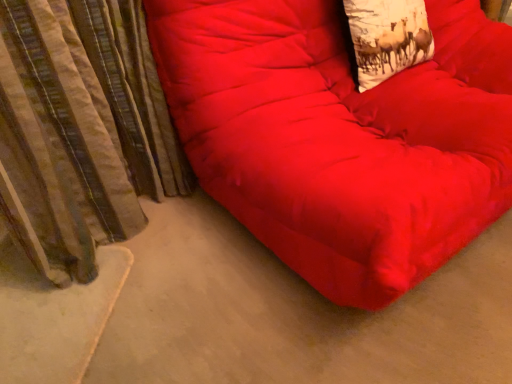
Question: Does white cotton throw pillow at upper right turn towards striped fabric curtain at left?

Choices:
 (A) no
 (B) yes

Answer: (A)

Question: Is white cotton throw pillow at upper right at the right side of striped fabric curtain at left?

Choices:
 (A) yes
 (B) no

Answer: (A)

Question: Considering the relative sizes of white cotton throw pillow at upper right and striped fabric curtain at left in the image provided, is white cotton throw pillow at upper right wider than striped fabric curtain at left?

Choices:
 (A) no
 (B) yes

Answer: (A)

Question: From a real-world perspective, does white cotton throw pillow at upper right sit lower than striped fabric curtain at left?

Choices:
 (A) yes
 (B) no

Answer: (B)

Question: Does white cotton throw pillow at upper right have a lesser width compared to striped fabric curtain at left?

Choices:
 (A) no
 (B) yes

Answer: (B)

Question: Is striped fabric curtain at left inside white cotton throw pillow at upper right?

Choices:
 (A) yes
 (B) no

Answer: (B)

Question: Is striped fabric curtain at left oriented away from matte red beanbag at center?

Choices:
 (A) no
 (B) yes

Answer: (A)

Question: Is striped fabric curtain at left next to matte red beanbag at center?

Choices:
 (A) yes
 (B) no

Answer: (B)

Question: From a real-world perspective, is striped fabric curtain at left positioned over matte red beanbag at center based on gravity?

Choices:
 (A) yes
 (B) no

Answer: (B)

Question: Is striped fabric curtain at left at the left side of matte red beanbag at center?

Choices:
 (A) yes
 (B) no

Answer: (A)

Question: From the image's perspective, is striped fabric curtain at left on top of matte red beanbag at center?

Choices:
 (A) no
 (B) yes

Answer: (A)

Question: Considering the relative sizes of striped fabric curtain at left and matte red beanbag at center in the image provided, is striped fabric curtain at left thinner than matte red beanbag at center?

Choices:
 (A) no
 (B) yes

Answer: (B)

Question: Is the surface of matte red beanbag at center in direct contact with striped fabric curtain at left?

Choices:
 (A) yes
 (B) no

Answer: (B)